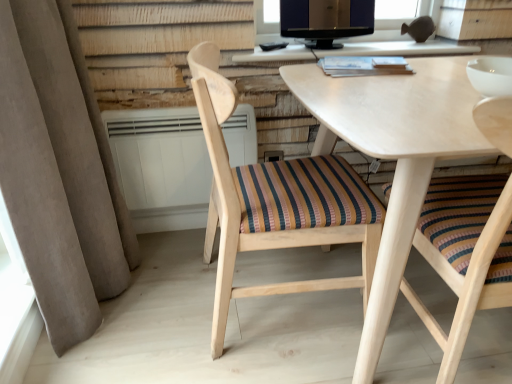
Question: Does wooden chair with striped cushion at center, the 2th chair viewed from the right, appear on the left side of white plastic radiator at center?

Choices:
 (A) yes
 (B) no

Answer: (B)

Question: Can you confirm if wooden chair with striped cushion at center, positioned as the first chair in left-to-right order, is thinner than white plastic radiator at center?

Choices:
 (A) yes
 (B) no

Answer: (B)

Question: Is wooden chair with striped cushion at center, positioned as the first chair in left-to-right order, further to camera compared to white plastic radiator at center?

Choices:
 (A) yes
 (B) no

Answer: (B)

Question: Is white plastic radiator at center at the back of wooden chair with striped cushion at center, positioned as the first chair in left-to-right order?

Choices:
 (A) yes
 (B) no

Answer: (B)

Question: Is wooden chair with striped cushion at center, positioned as the first chair in left-to-right order, positioned before white plastic radiator at center?

Choices:
 (A) yes
 (B) no

Answer: (A)

Question: Considering their positions, is wooden chair with striped cushion at center, the 2th chair viewed from the right, located in front of or behind wooden chair with striped cushion at center, which appears as the 2th chair when viewed from the left?

Choices:
 (A) front
 (B) behind

Answer: (B)

Question: Considering the positions of wooden chair with striped cushion at center, positioned as the first chair in left-to-right order, and wooden chair with striped cushion at center, which appears as the 2th chair when viewed from the left, in the image, is wooden chair with striped cushion at center, positioned as the first chair in left-to-right order, wider or thinner than wooden chair with striped cushion at center, which appears as the 2th chair when viewed from the left,?

Choices:
 (A) wide
 (B) thin

Answer: (A)

Question: Is wooden chair with striped cushion at center, the 2th chair viewed from the right, situated inside wooden chair with striped cushion at center, which appears as the 2th chair when viewed from the left, or outside?

Choices:
 (A) inside
 (B) outside

Answer: (B)

Question: Considering the positions of wooden chair with striped cushion at center, the 2th chair viewed from the right, and wooden chair with striped cushion at center, which appears as the 2th chair when viewed from the left, in the image, is wooden chair with striped cushion at center, the 2th chair viewed from the right, taller or shorter than wooden chair with striped cushion at center, which appears as the 2th chair when viewed from the left,?

Choices:
 (A) tall
 (B) short

Answer: (B)

Question: Considering their positions, is matte black monitor at upper center located in front of or behind beige fabric curtain at left?

Choices:
 (A) front
 (B) behind

Answer: (B)

Question: Is matte black monitor at upper center taller or shorter than beige fabric curtain at left?

Choices:
 (A) short
 (B) tall

Answer: (A)

Question: Visually, is matte black monitor at upper center positioned to the left or to the right of beige fabric curtain at left?

Choices:
 (A) right
 (B) left

Answer: (A)

Question: From a real-world perspective, is matte black monitor at upper center physically located above or below beige fabric curtain at left?

Choices:
 (A) below
 (B) above

Answer: (B)

Question: Is point (493, 210) closer or farther from the camera than point (327, 3)?

Choices:
 (A) closer
 (B) farther

Answer: (A)

Question: Considering their positions, is wooden chair with striped cushion at center, which appears as the 2th chair when viewed from the left, located in front of or behind matte black monitor at upper center?

Choices:
 (A) behind
 (B) front

Answer: (B)